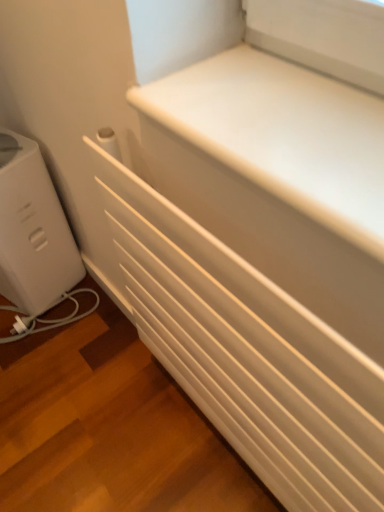
I want to click on white matte radiator at center, so click(x=248, y=353).

I want to click on white matte radiator at lower left, so click(x=109, y=428).

What is the approximate height of white plastic toaster at left?

white plastic toaster at left is 21.44 inches in height.

Measure the distance between point (37, 232) and camera.

Point (37, 232) is 3.94 feet away from camera.

What are the coordinates of `white matte radiator at center` in the screenshot? It's located at (248, 353).

In the scene shown: From the image's perspective, would you say white matte radiator at lower left is shown under white plastic toaster at left?

Correct, white matte radiator at lower left appears lower than white plastic toaster at left in the image.

Considering the relative positions of white matte radiator at lower left and white plastic toaster at left in the image provided, is white matte radiator at lower left to the left or to the right of white plastic toaster at left?

Clearly, white matte radiator at lower left is on the right of white plastic toaster at left in the image.

From a real-world perspective, is white matte radiator at lower left physically located above or below white plastic toaster at left?

Clearly, from a real-world perspective, white matte radiator at lower left is below white plastic toaster at left.

Is white plastic toaster at left at the back of white matte radiator at lower left?

Yes, white matte radiator at lower left is facing away from white plastic toaster at left.

You are a GUI agent. You are given a task and a screenshot of the screen. Output one action in this format:
    pyautogui.click(x=<x>, y=<y>)
    Task: Click on the stairwell below the white matte radiator at center (from a real-world perspective)
    
    Given the screenshot: What is the action you would take?
    pyautogui.click(x=109, y=428)

From a real-world perspective, is white matte radiator at center under white matte radiator at lower left?

Incorrect, from a real-world perspective, white matte radiator at center is higher than white matte radiator at lower left.

Is white matte radiator at center positioned far away from white matte radiator at lower left?

No, white matte radiator at center is not far away from white matte radiator at lower left.

Considering the sizes of white plastic toaster at left and white matte radiator at lower left in the image, is white plastic toaster at left bigger or smaller than white matte radiator at lower left?

In the image, white plastic toaster at left appears to be larger than white matte radiator at lower left.

The height and width of the screenshot is (512, 384). I want to click on home appliance behind the white matte radiator at lower left, so click(33, 230).

In the scene shown: Which is in front, white plastic toaster at left or white matte radiator at lower left?

white matte radiator at lower left is in front.

Measure the distance between white plastic toaster at left and white matte radiator at lower left.

They are 13.74 inches apart.

Looking at the image, does white plastic toaster at left seem bigger or smaller compared to white matte radiator at center?

Considering their sizes, white plastic toaster at left takes up more space than white matte radiator at center.

Consider the image. From the image's perspective, is white plastic toaster at left on top of white matte radiator at center?

Indeed, from the image's perspective, white plastic toaster at left is shown above white matte radiator at center.

Is white plastic toaster at left wider or thinner than white matte radiator at center?

Clearly, white plastic toaster at left has more width compared to white matte radiator at center.

From a real-world perspective, is white matte radiator at center beneath white plastic toaster at left?

Actually, white matte radiator at center is physically above white plastic toaster at left in the real world.

Based on the photo, could you tell me if white matte radiator at center is facing white plastic toaster at left?

No, white matte radiator at center is not aimed at white plastic toaster at left.

Which is closer, (x=153, y=347) or (x=18, y=246)?

Point (x=153, y=347) appears to be closer to the viewer than point (x=18, y=246).

Considering the relative sizes of white matte radiator at lower left and white matte radiator at center in the image provided, is white matte radiator at lower left shorter than white matte radiator at center?

Indeed, white matte radiator at lower left has a lesser height compared to white matte radiator at center.

Is white matte radiator at lower left wider than white matte radiator at center?

Indeed, white matte radiator at lower left has a greater width compared to white matte radiator at center.

This screenshot has width=384, height=512. Find the location of `radiator to the right of white matte radiator at lower left`. radiator to the right of white matte radiator at lower left is located at coordinates (248, 353).

Find the location of `home appliance above the white matte radiator at lower left (from a real-world perspective)`. home appliance above the white matte radiator at lower left (from a real-world perspective) is located at coordinates (33, 230).

In the image, there is a white matte radiator at center. Identify the location of stairwell below it (from the image's perspective). (109, 428).

Estimate the real-world distances between objects in this image. Which object is further from white plastic toaster at left, white matte radiator at center or white matte radiator at lower left?

white matte radiator at center is positioned further to the anchor white plastic toaster at left.

Estimate the real-world distances between objects in this image. Which object is closer to white matte radiator at center, white matte radiator at lower left or white plastic toaster at left?

white matte radiator at lower left lies closer to white matte radiator at center than the other object.

Looking at the image, which one is located closer to white matte radiator at lower left, white matte radiator at center or white plastic toaster at left?

white plastic toaster at left.

Which object lies nearer to the anchor point white matte radiator at lower left, white plastic toaster at left or white matte radiator at center?

white plastic toaster at left is closer to white matte radiator at lower left.

Looking at the image, which one is located closer to white plastic toaster at left, white matte radiator at lower left or white matte radiator at center?

Among the two, white matte radiator at lower left is located nearer to white plastic toaster at left.

Considering their positions, is white plastic toaster at left positioned further to white matte radiator at center than white matte radiator at lower left?

white plastic toaster at left lies further to white matte radiator at center than the other object.

Where is `stairwell between white matte radiator at center and white plastic toaster at left along the z-axis`? This screenshot has height=512, width=384. stairwell between white matte radiator at center and white plastic toaster at left along the z-axis is located at coordinates (109, 428).